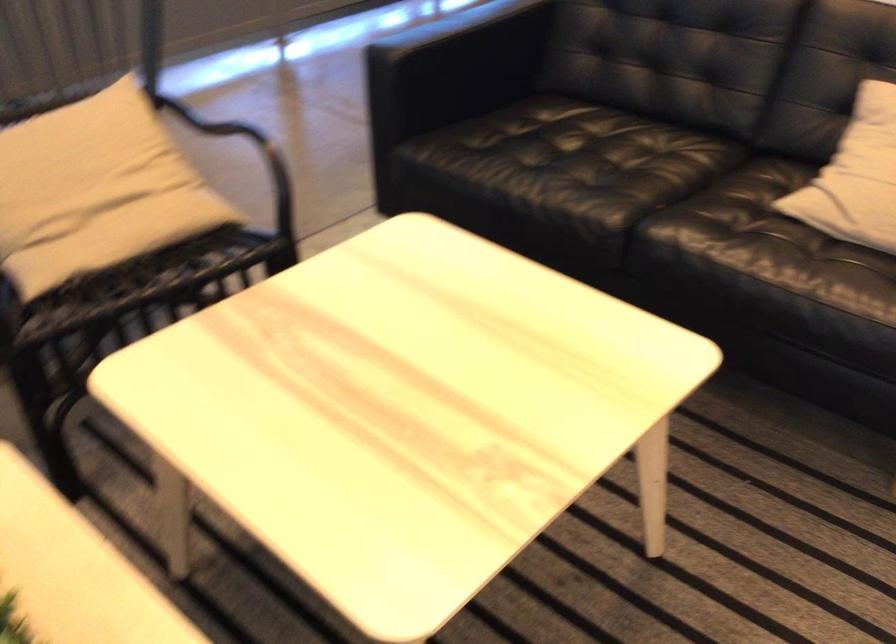
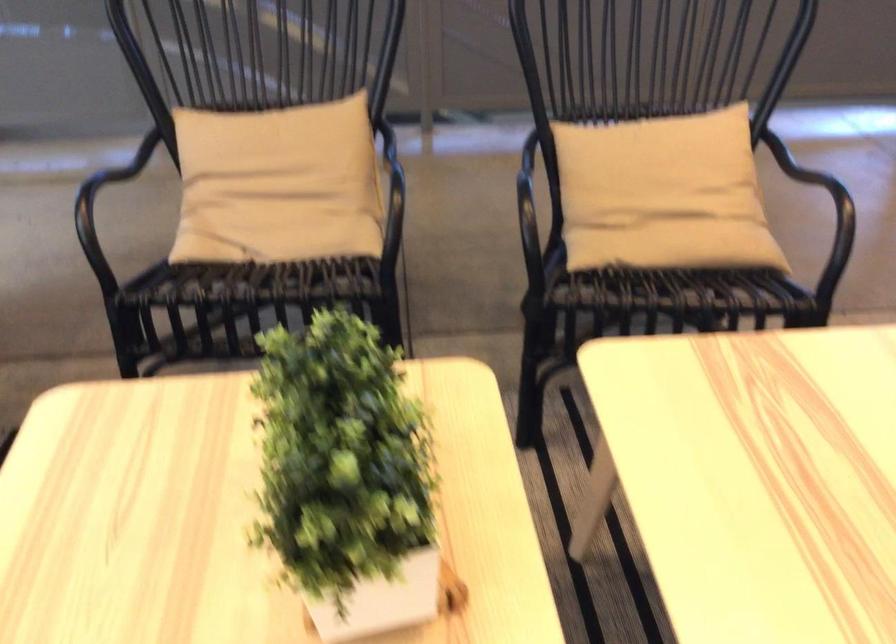
Find the pixel in the second image that matches (x=128, y=237) in the first image.

(674, 245)